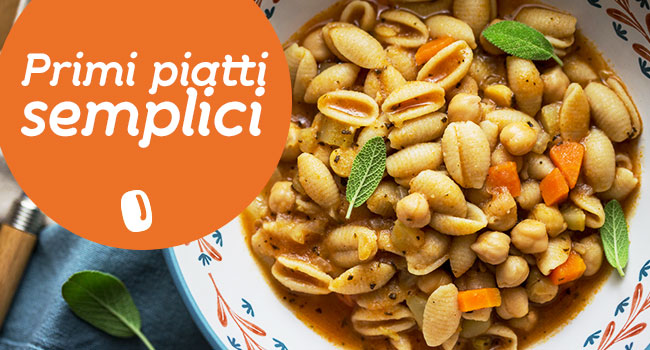
At what (x,y) coordinates should I click in order to perform the action: click on wood handle. Please return your answer as a coordinate pair (x, y). The width and height of the screenshot is (650, 350). Looking at the image, I should click on (20, 248).